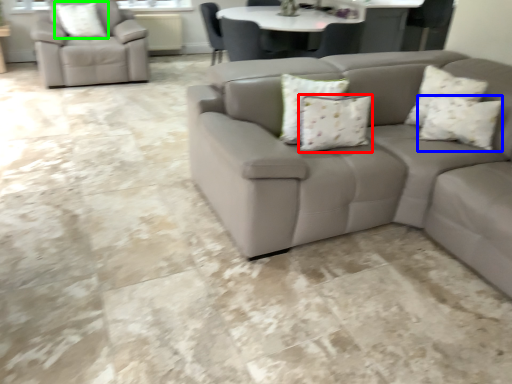
Question: Estimate the real-world distances between objects in this image. Which object is closer to pillow (highlighted by a red box), pillow (highlighted by a blue box) or pillow (highlighted by a green box)?

Choices:
 (A) pillow
 (B) pillow

Answer: (A)